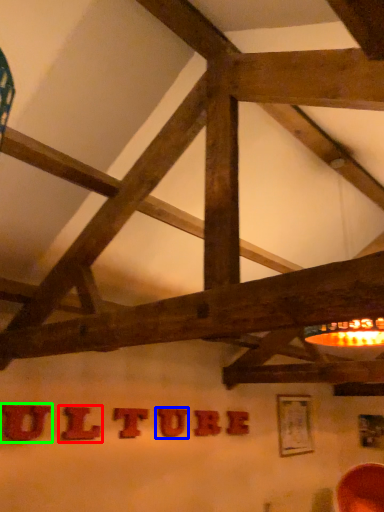
Question: Which object is the closest to the letter (highlighted by a red box)? Choose among these: letter (highlighted by a blue box) or letter (highlighted by a green box).

Choices:
 (A) letter
 (B) letter

Answer: (B)